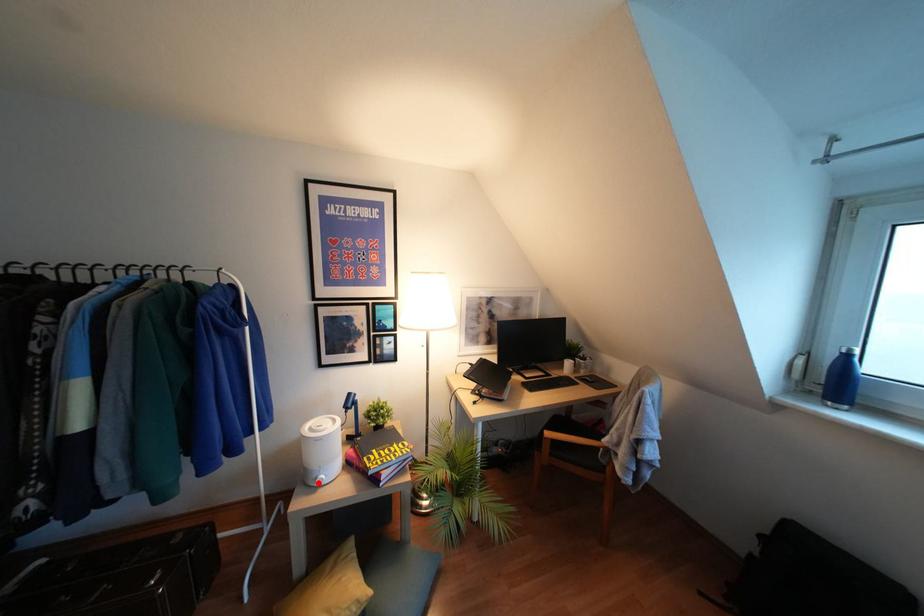
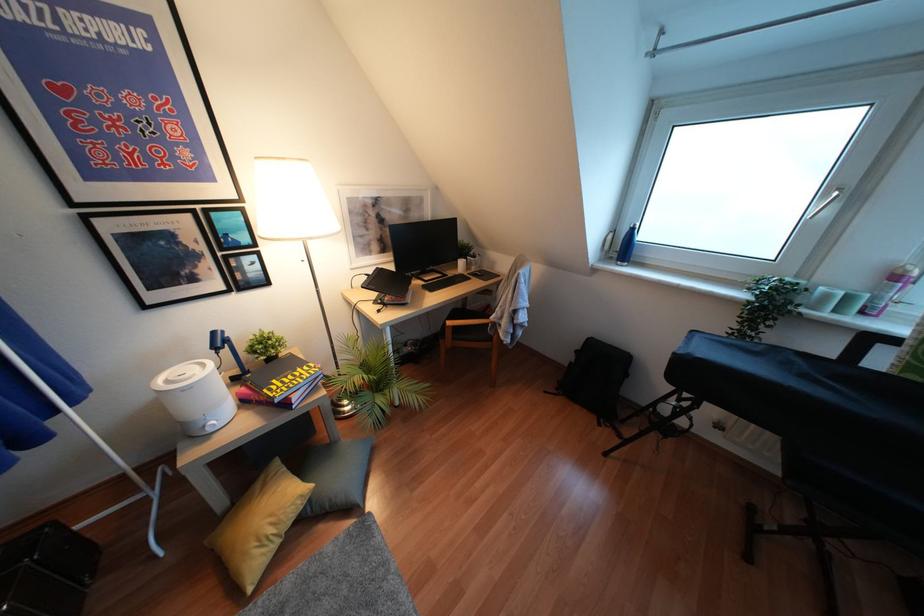
Question: I am providing you with two images of the same scene from different viewpoints. Image1 has a red point marked. In image2, the corresponding 3D location appears at what relative position? Reply with the corresponding letter.

Choices:
 (A) Closer
 (B) Farther

Answer: (A)